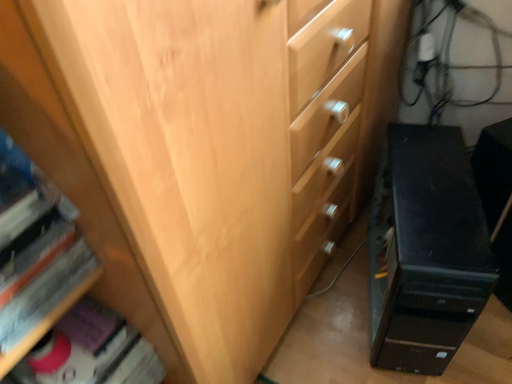
Question: Is matte pink book at lower left, which is the second book from top to bottom, surrounded by black plastic computer tower at lower right?

Choices:
 (A) no
 (B) yes

Answer: (A)

Question: Is black plastic computer tower at lower right at the left side of matte pink book at lower left, arranged as the second book when viewed from the front?

Choices:
 (A) yes
 (B) no

Answer: (B)

Question: From a real-world perspective, does black plastic computer tower at lower right sit lower than matte pink book at lower left, placed as the 1th book when sorted from bottom to top?

Choices:
 (A) no
 (B) yes

Answer: (B)

Question: Can you confirm if black plastic computer tower at lower right is wider than matte pink book at lower left, arranged as the second book when viewed from the front?

Choices:
 (A) yes
 (B) no

Answer: (A)

Question: Is black plastic computer tower at lower right positioned with its back to matte pink book at lower left, the 1th book when ordered from back to front?

Choices:
 (A) no
 (B) yes

Answer: (A)

Question: Is black plastic computer tower at lower right in front of or behind matte pink book at lower left, placed as the 1th book when sorted from bottom to top, in the image?

Choices:
 (A) behind
 (B) front

Answer: (A)

Question: Is black plastic computer tower at lower right spatially inside matte pink book at lower left, placed as the 1th book when sorted from bottom to top, or outside of it?

Choices:
 (A) outside
 (B) inside

Answer: (A)

Question: Is point (451, 142) closer or farther from the camera than point (159, 365)?

Choices:
 (A) farther
 (B) closer

Answer: (A)

Question: Based on their sizes in the image, would you say black plastic computer tower at lower right is bigger or smaller than matte pink book at lower left, placed as the 1th book when sorted from bottom to top?

Choices:
 (A) big
 (B) small

Answer: (A)

Question: In terms of height, does black plastic computer tower at lower right look taller or shorter compared to hardcover book at lower left, the first book viewed from the top?

Choices:
 (A) tall
 (B) short

Answer: (A)

Question: Considering their positions, is black plastic computer tower at lower right located in front of or behind hardcover book at lower left, which appears as the 2th book when viewed from the back?

Choices:
 (A) behind
 (B) front

Answer: (A)

Question: Which is correct: black plastic computer tower at lower right is inside hardcover book at lower left, which is the second book from bottom to top, or outside of it?

Choices:
 (A) outside
 (B) inside

Answer: (A)

Question: Looking at their shapes, would you say black plastic computer tower at lower right is wider or thinner than hardcover book at lower left, which appears as the 2th book when viewed from the back?

Choices:
 (A) wide
 (B) thin

Answer: (A)

Question: From a real-world perspective, is matte pink book at lower left, which is the second book from top to bottom, above or below black plastic computer tower at lower right?

Choices:
 (A) above
 (B) below

Answer: (A)

Question: Looking at the image, does matte pink book at lower left, the 1th book when ordered from back to front, seem bigger or smaller compared to black plastic computer tower at lower right?

Choices:
 (A) big
 (B) small

Answer: (B)